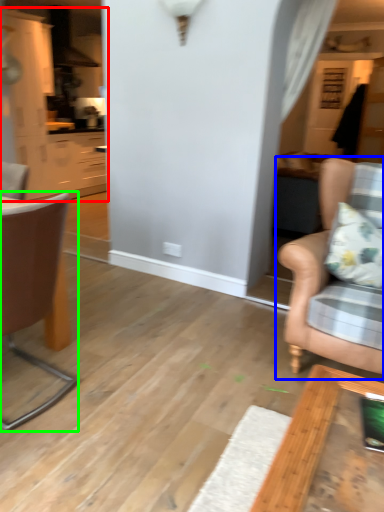
Question: Which object is the closest to the cabinetry (highlighted by a red box)? Choose among these: chair (highlighted by a blue box) or chair (highlighted by a green box).

Choices:
 (A) chair
 (B) chair

Answer: (B)